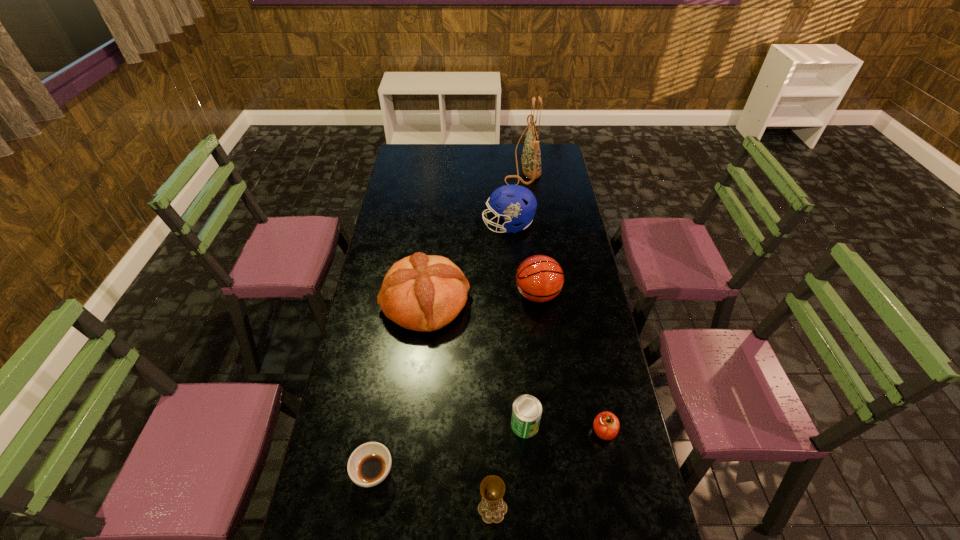
Locate an element on the screen. The width and height of the screenshot is (960, 540). handbag is located at coordinates (531, 156).

Locate an element on the screen. The height and width of the screenshot is (540, 960). the farthest object is located at coordinates (531, 156).

In order to click on the second farthest object in this screenshot , I will do `click(516, 204)`.

This screenshot has width=960, height=540. Find the location of `basketball`. basketball is located at coordinates (539, 278).

The width and height of the screenshot is (960, 540). I want to click on bread, so click(421, 292).

Image resolution: width=960 pixels, height=540 pixels. What are the coordinates of `the fifth tallest object` in the screenshot? It's located at (492, 508).

Identify the location of the third shortest object. The height and width of the screenshot is (540, 960). (526, 413).

I want to click on the rightmost object, so click(606, 425).

The width and height of the screenshot is (960, 540). Find the location of `soup bowl`. soup bowl is located at coordinates (370, 463).

Locate an element on the screen. vacant region located on the front-facing side of the farthest object is located at coordinates (436, 166).